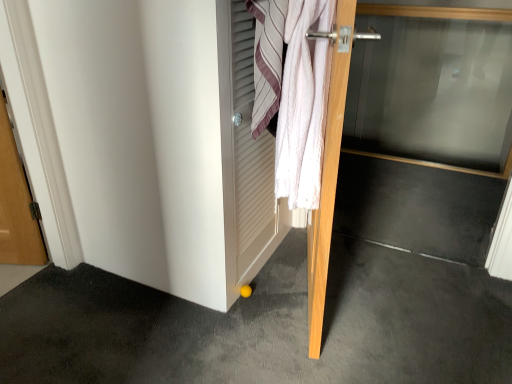
Question: Is wooden door at center, acting as the second door starting from the right, bigger or smaller than white cotton towel at upper right?

Choices:
 (A) small
 (B) big

Answer: (B)

Question: From the image's perspective, is wooden door at center, acting as the second door starting from the right, positioned above or below white cotton towel at upper right?

Choices:
 (A) above
 (B) below

Answer: (B)

Question: Estimate the real-world distances between objects in this image. Which object is closer to the white textured towel at center?

Choices:
 (A) transparent glass door at center, marked as the 2th door in a left-to-right arrangement
 (B) wooden door at center, placed as the first door when sorted from left to right
 (C) yellow rubber ball at lower center
 (D) white cotton towel at upper right

Answer: (D)

Question: Which object is positioned farthest from the transparent glass door at center, placed as the first door when sorted from right to left?

Choices:
 (A) white cotton towel at upper right
 (B) white textured towel at center
 (C) yellow rubber ball at lower center
 (D) wooden door at center, placed as the first door when sorted from left to right

Answer: (C)